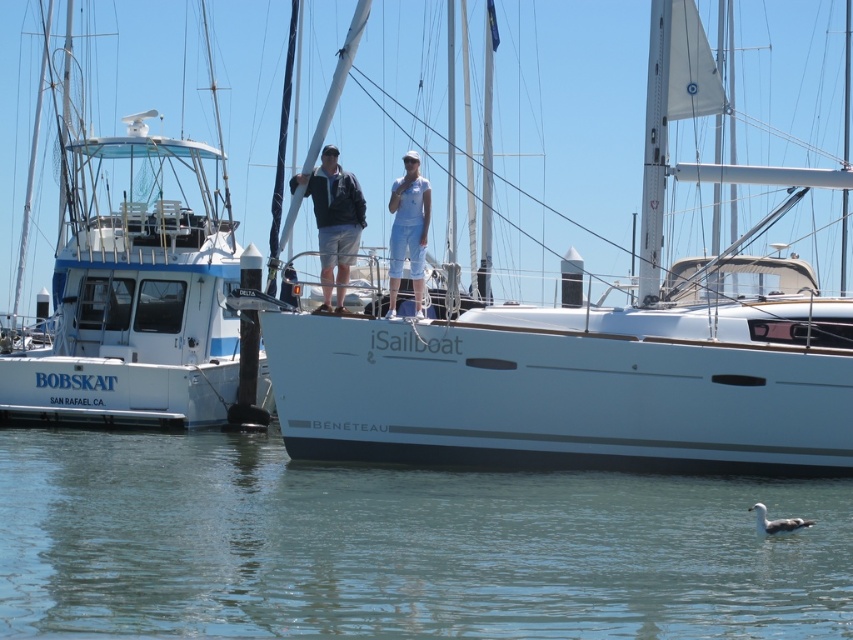
Question: Which object appears closest to the camera in this image?

Choices:
 (A) white glossy sailboat at center
 (B) clear blue water at lower center
 (C) light blue denim shorts at center

Answer: (B)

Question: Does clear blue water at lower center have a lesser width compared to white matte boat at left?

Choices:
 (A) yes
 (B) no

Answer: (B)

Question: In this image, where is white glossy sailboat at center located relative to light blue denim shorts at center?

Choices:
 (A) above
 (B) below

Answer: (A)

Question: Is clear blue water at lower center closer to the viewer compared to white matte boat at left?

Choices:
 (A) yes
 (B) no

Answer: (A)

Question: Among these objects, which one is farthest from the camera?

Choices:
 (A) light blue denim shorts at center
 (B) clear blue water at lower center
 (C) white matte boat at left
 (D) white glossy sailboat at center

Answer: (C)

Question: Considering the real-world distances, which object is farthest from the white glossy sailboat at center?

Choices:
 (A) light blue denim shorts at center
 (B) clear blue water at lower center

Answer: (B)